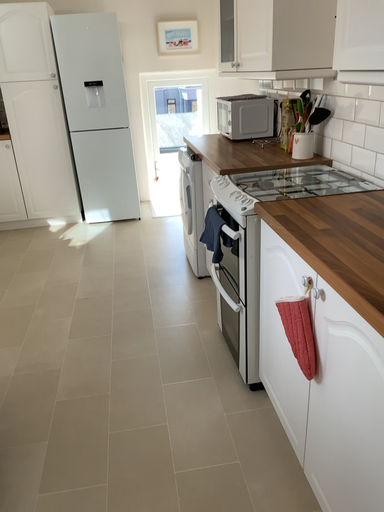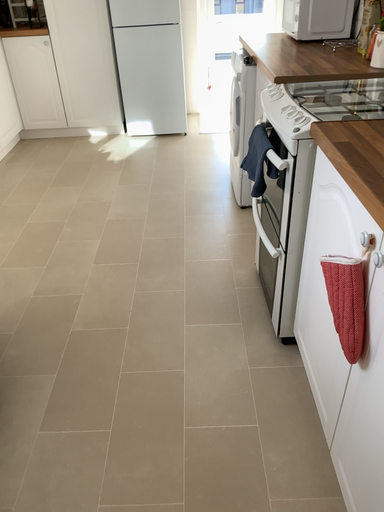
Question: Which way did the camera rotate in the video?

Choices:
 (A) rotated left
 (B) rotated right

Answer: (A)